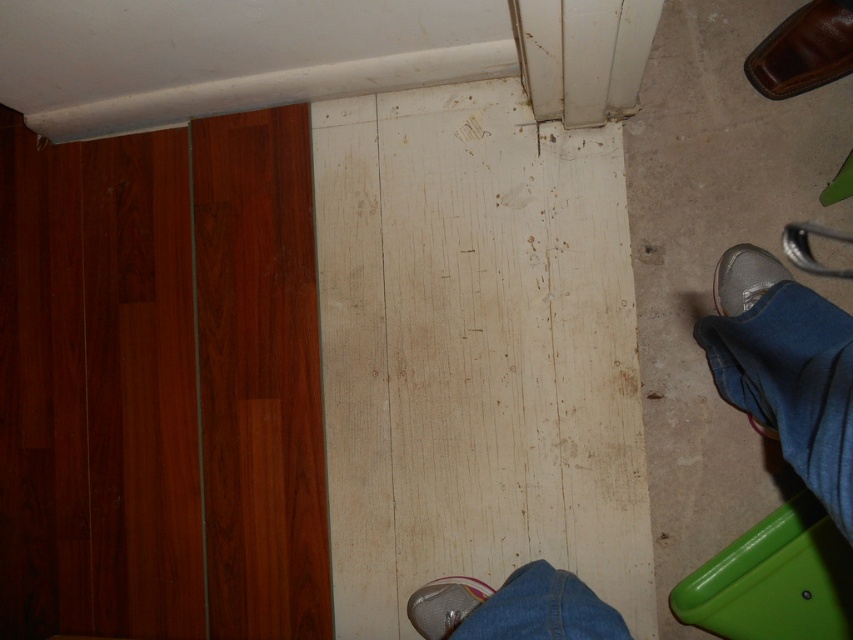
Question: Where is silver metallic shoe at lower right located in relation to metallic silver shoe at lower center in the image?

Choices:
 (A) above
 (B) below

Answer: (A)

Question: Which is farther from the denim pants at lower right?

Choices:
 (A) brown leather shoe at upper right
 (B) metallic silver shoe at lower center
 (C) silver metallic shoe at lower right

Answer: (B)

Question: Can you confirm if denim pants at lower right is smaller than metallic silver shoe at lower center?

Choices:
 (A) yes
 (B) no

Answer: (B)

Question: Can you confirm if silver metallic shoe at lower right is smaller than metallic silver shoe at lower center?

Choices:
 (A) yes
 (B) no

Answer: (B)

Question: Which point is farther to the camera?

Choices:
 (A) brown leather shoe at upper right
 (B) metallic silver shoe at lower center

Answer: (B)

Question: Which object is closer to the camera taking this photo?

Choices:
 (A) silver metallic shoe at lower right
 (B) denim pants at lower right
 (C) brown leather shoe at upper right
 (D) metallic silver shoe at lower center

Answer: (B)